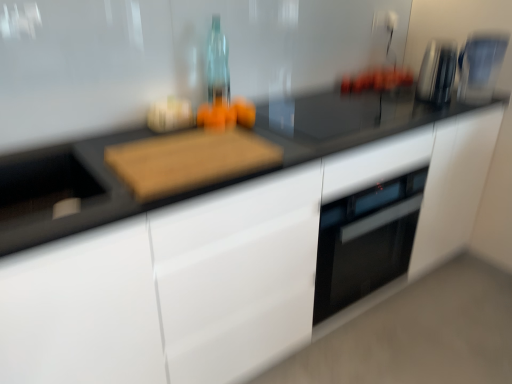
Find the location of a particular element. Image resolution: width=512 pixels, height=384 pixels. vacant region above wooden cutting board at center (from a real-world perspective) is located at coordinates (193, 145).